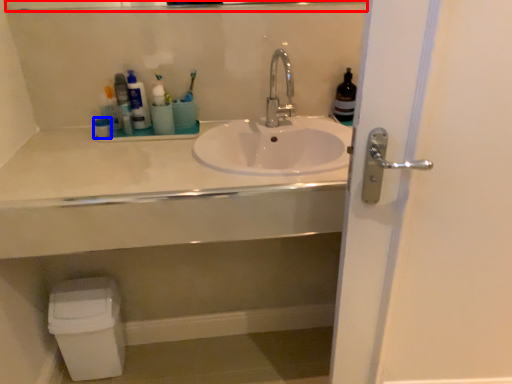
Question: Which object appears closest to the camera in this image, mirror (highlighted by a red box) or toiletry (highlighted by a blue box)?

Choices:
 (A) mirror
 (B) toiletry

Answer: (A)